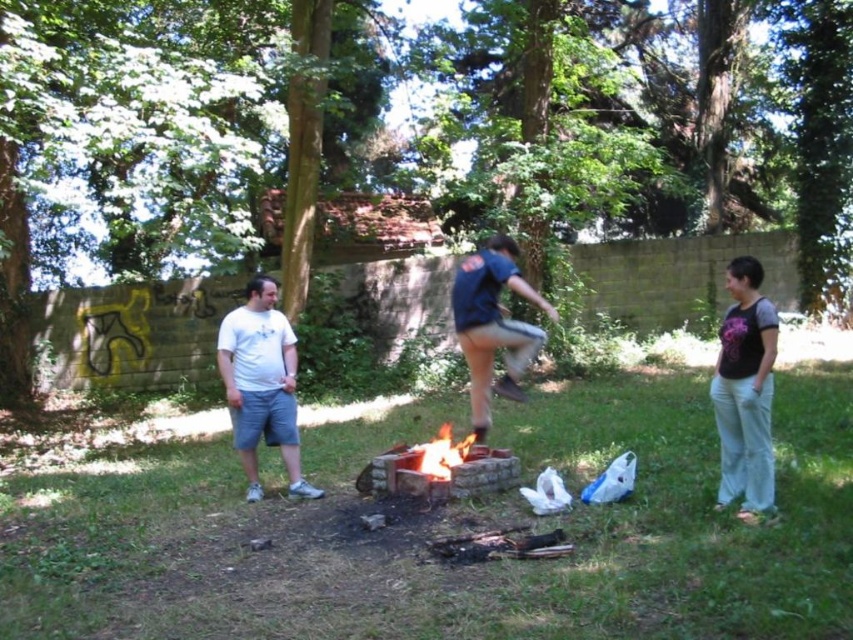
Is matte black shirt at lower right positioned in front of flaming wood at center?

Yes, it is in front of flaming wood at center.

In the scene shown: Which is more to the right, matte black shirt at lower right or flaming wood at center?

From the viewer's perspective, matte black shirt at lower right appears more on the right side.

Between point (767, 401) and point (428, 467), which one is positioned behind?

The point (428, 467) is more distant.

I want to click on matte black shirt at lower right, so click(x=746, y=392).

Which is more to the left, dark blue shirt at center or flaming wood at center?

flaming wood at center

Can you confirm if dark blue shirt at center is bigger than flaming wood at center?

Correct, dark blue shirt at center is larger in size than flaming wood at center.

Which is in front, point (526, 358) or point (445, 449)?

Positioned in front is point (526, 358).

Where is `dark blue shirt at center`? This screenshot has width=853, height=640. dark blue shirt at center is located at coordinates (492, 324).

Does white matte shorts at left have a greater height compared to flaming wood at center?

Yes, white matte shorts at left is taller than flaming wood at center.

Does white matte shorts at left have a lesser height compared to flaming wood at center?

In fact, white matte shorts at left may be taller than flaming wood at center.

I want to click on white matte shorts at left, so click(260, 385).

Find the location of `white matte shorts at left`. white matte shorts at left is located at coordinates (260, 385).